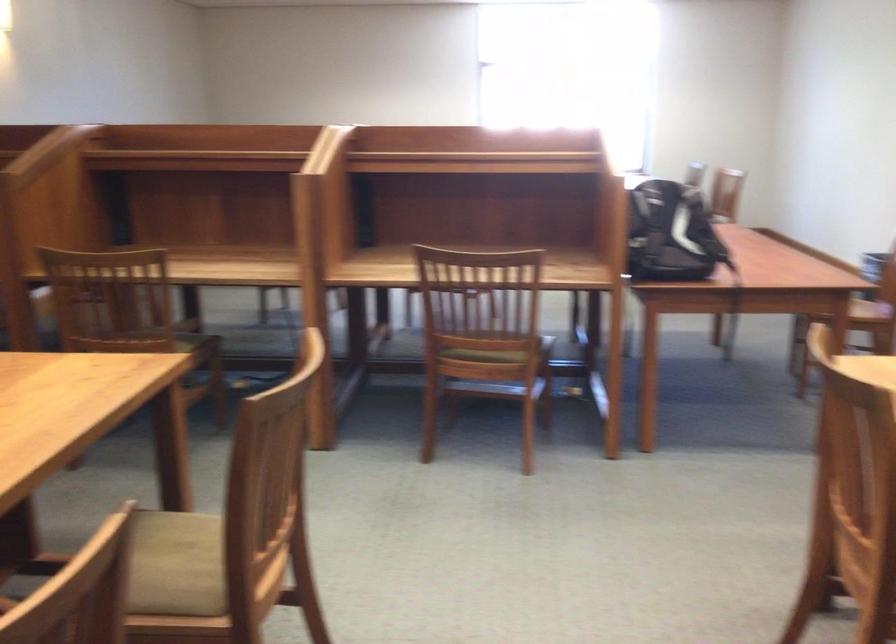
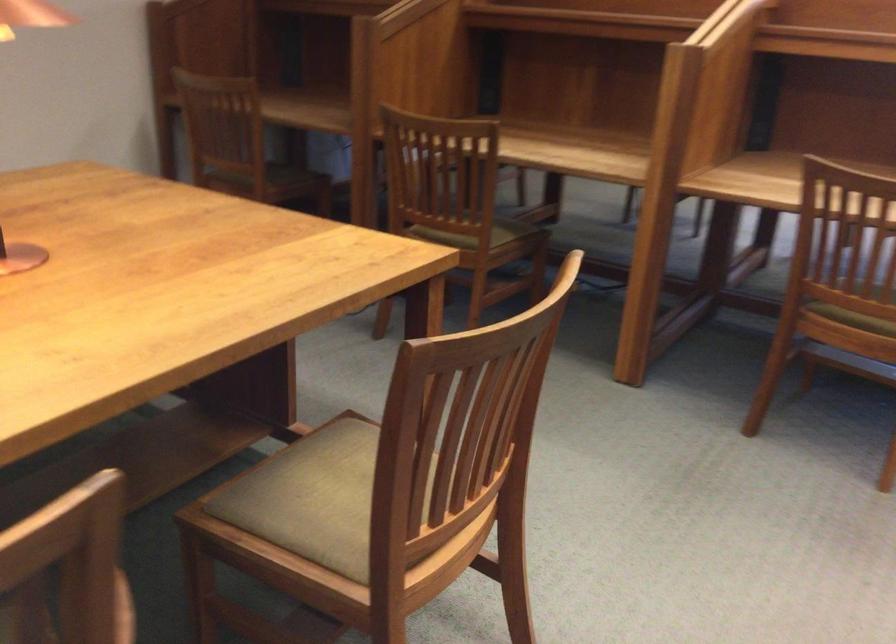
Question: The first image is from the beginning of the video and the second image is from the end. How did the camera likely rotate when shooting the video?

Choices:
 (A) Left
 (B) Right
 (C) Up
 (D) Down

Answer: (A)